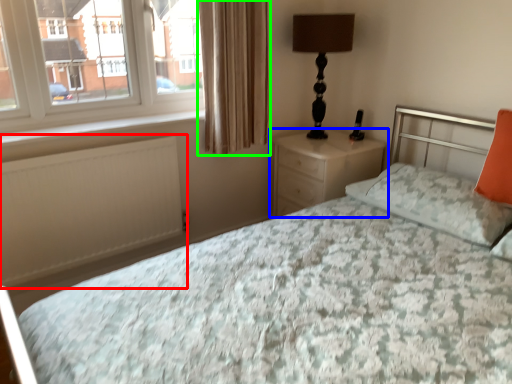
Question: Which is farther away from radiator (highlighted by a red box)? nightstand (highlighted by a blue box) or curtain (highlighted by a green box)?

Choices:
 (A) nightstand
 (B) curtain

Answer: (A)